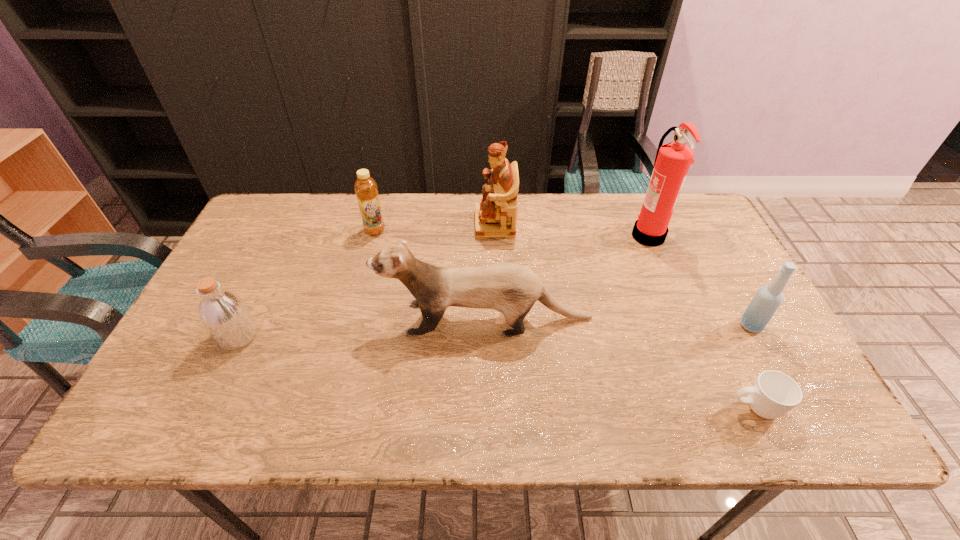
The image size is (960, 540). Identify the location of free space between the ferret and the rightmost object. (618, 322).

You are a GUI agent. You are given a task and a screenshot of the screen. Output one action in this format:
    pyautogui.click(x=<x>, y=<y>)
    Task: Click on the free space between the shortest object and the second bottle from left to right
    This screenshot has height=540, width=960.
    Given the screenshot: What is the action you would take?
    pyautogui.click(x=564, y=320)

This screenshot has width=960, height=540. I want to click on free space that is in between the fire extinguisher and the shortest object, so click(x=701, y=321).

The height and width of the screenshot is (540, 960). Identify the location of vacant point located between the figurine and the fire extinguisher. (571, 230).

The width and height of the screenshot is (960, 540). I want to click on empty space between the fire extinguisher and the rightmost bottle, so click(x=699, y=280).

Locate an element on the screen. The width and height of the screenshot is (960, 540). free space between the rightmost object and the cup is located at coordinates (753, 367).

Find the location of a particular element. Image resolution: width=960 pixels, height=540 pixels. vacant region between the rightmost object and the figurine is located at coordinates (623, 275).

What are the coordinates of `free space between the cup and the rightmost bottle` in the screenshot? It's located at (753, 367).

Find the location of a particular element. vacant space that's between the leftmost object and the figurine is located at coordinates (366, 280).

Find the location of a particular element. vacant point located between the tallest object and the nearest object is located at coordinates (701, 321).